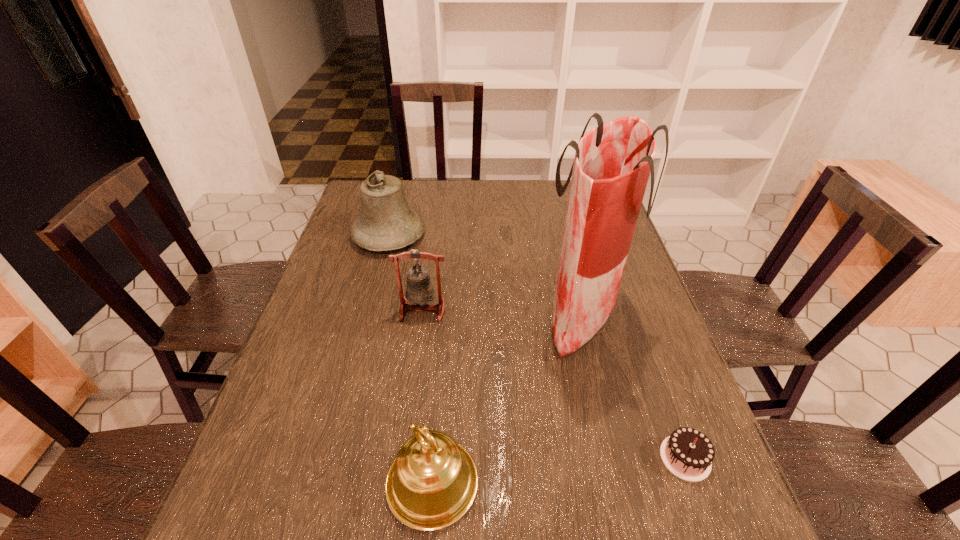
Locate an element on the screen. The height and width of the screenshot is (540, 960). the tallest object is located at coordinates (612, 163).

Find the location of a particular element. the farthest bell is located at coordinates (386, 222).

Identify the location of the second nearest bell. (419, 290).

Locate an element on the screen. the nearest bell is located at coordinates (431, 484).

This screenshot has width=960, height=540. Identify the location of chocolate cake. (687, 453).

At what (x,y) coordinates should I click in order to perform the action: click on vacant area situated 0.160m on the front of the grocery bag. Please return your answer as a coordinate pair (x, y). Looking at the image, I should click on (608, 424).

You are a GUI agent. You are given a task and a screenshot of the screen. Output one action in this format:
    pyautogui.click(x=<x>, y=<y>)
    Task: Click on the vacant region located on the right of the farthest object
    This screenshot has width=960, height=540.
    Given the screenshot: What is the action you would take?
    pyautogui.click(x=460, y=235)

In order to click on free space located 0.100m on the front of the second farthest bell in this screenshot , I will do `click(417, 353)`.

Locate an element on the screen. This screenshot has width=960, height=540. free region located 0.310m on the right of the nearest bell is located at coordinates (643, 483).

This screenshot has height=540, width=960. In order to click on vacant area situated on the back of the shortest object in this screenshot , I will do `click(660, 386)`.